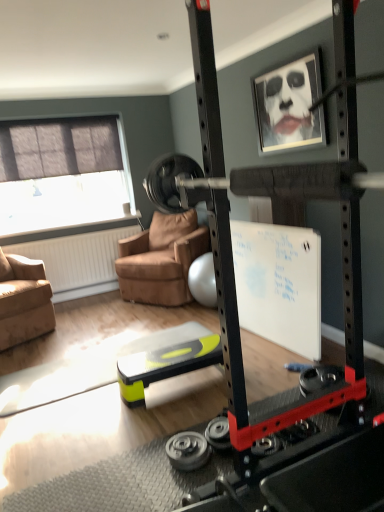
Question: Is point (188, 267) closer or farther from the camera than point (193, 465)?

Choices:
 (A) closer
 (B) farther

Answer: (B)

Question: Is brown leather chair at center, the 1th chair viewed from the right, bigger or smaller than black rubber weight at lower center, which is the 1th wheel in bottom-to-top order?

Choices:
 (A) small
 (B) big

Answer: (B)

Question: Estimate the real-world distances between objects in this image. Which object is closer to the brown leather chair at center, the 1th chair viewed from the right?

Choices:
 (A) metallic gray wheel at lower center, arranged as the second wheel when ordered from the bottom
 (B) matte black picture frame at upper center
 (C) black rubber weight at lower center, the 2th wheel from the top
 (D) suede brown armchair at left, the second chair when ordered from right to left
 (E) matte gray window at upper left

Answer: (E)

Question: Which of these objects is positioned closest to the matte black picture frame at upper center?

Choices:
 (A) black rubber weight at lower center, the 2th wheel from the top
 (B) metallic gray wheel at lower center, marked as the first wheel in a top-to-bottom arrangement
 (C) matte gray window at upper left
 (D) brown leather chair at center, marked as the second chair in a left-to-right arrangement
 (E) suede brown armchair at left, positioned as the 1th chair in left-to-right order

Answer: (D)